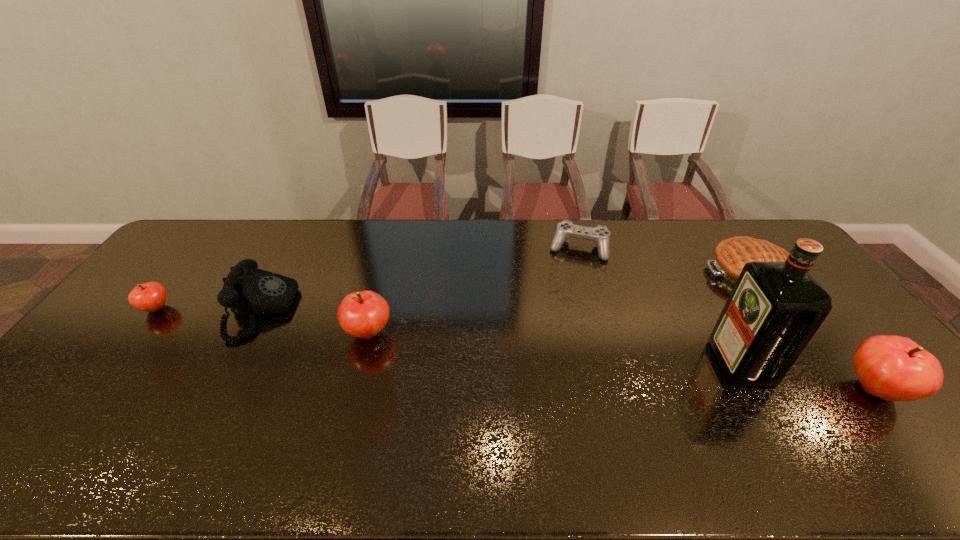
Image resolution: width=960 pixels, height=540 pixels. What are the coordinates of `free space at the left edge of the desktop` in the screenshot? It's located at (165, 267).

Find the location of `free space at the right edge of the desktop`. free space at the right edge of the desktop is located at coordinates (838, 316).

Locate an element on the screen. The height and width of the screenshot is (540, 960). vacant space at the far left corner of the desktop is located at coordinates (224, 226).

You are a GUI agent. You are given a task and a screenshot of the screen. Output one action in this format:
    pyautogui.click(x=<x>, y=<y>)
    Task: Click on the free space between the leftmost apple and the sixth object from right to left
    The height and width of the screenshot is (540, 960).
    Given the screenshot: What is the action you would take?
    pyautogui.click(x=209, y=309)

Identify the location of free area in between the shortest apple and the tallest object. (x=448, y=336).

Identify the location of free space between the second shortest apple and the pie. This screenshot has height=540, width=960. (559, 302).

The height and width of the screenshot is (540, 960). I want to click on free space between the second shortest apple and the telephone, so click(x=315, y=321).

The height and width of the screenshot is (540, 960). In order to click on vacant space that's between the leftmost apple and the rightmost apple in this screenshot , I will do [x=516, y=349].

The height and width of the screenshot is (540, 960). Identify the location of vacant space that's between the leftmost apple and the pie. coord(453,290).

At what (x,y) coordinates should I click in order to perform the action: click on free point between the pie and the third object from left to right. Please return your answer as a coordinate pair (x, y). Looking at the image, I should click on (559, 302).